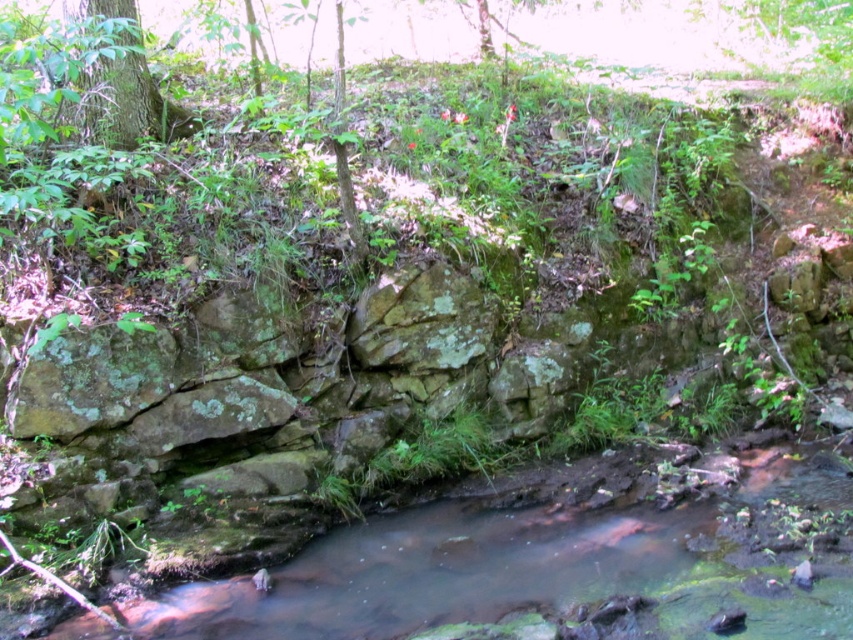
Can you confirm if clear water at center is wider than green mossy tree at upper left?

Indeed, clear water at center has a greater width compared to green mossy tree at upper left.

Describe the element at coordinates (555, 566) in the screenshot. I see `clear water at center` at that location.

Find the location of a particular element. The image size is (853, 640). clear water at center is located at coordinates (555, 566).